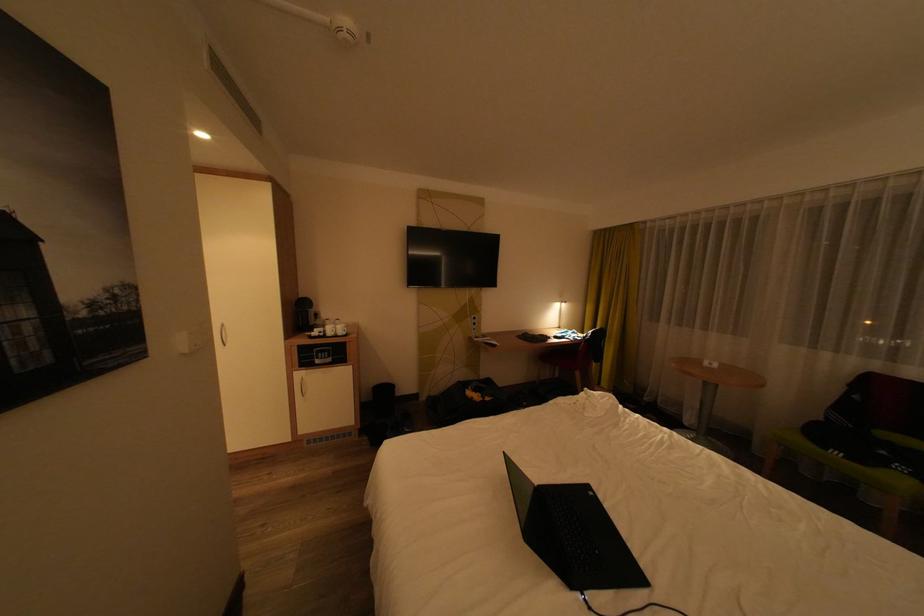
The location [305,314] corresponds to which object?

It corresponds to the black coffee machine in the image.